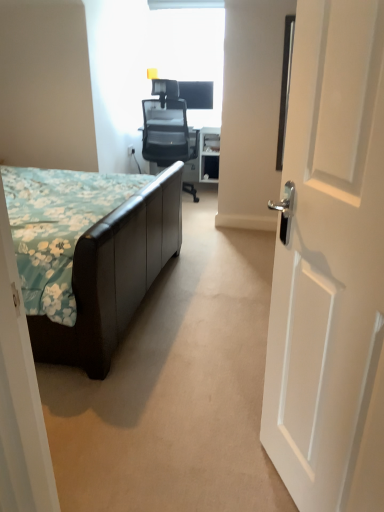
Question: From the image's perspective, does black mesh office chair at center appear lower than brown leather bed at left?

Choices:
 (A) yes
 (B) no

Answer: (B)

Question: Is black mesh office chair at center closer to camera compared to brown leather bed at left?

Choices:
 (A) yes
 (B) no

Answer: (B)

Question: Does black mesh office chair at center appear on the left side of brown leather bed at left?

Choices:
 (A) yes
 (B) no

Answer: (B)

Question: Does black mesh office chair at center have a smaller size compared to brown leather bed at left?

Choices:
 (A) no
 (B) yes

Answer: (B)

Question: Is black mesh office chair at center aimed at brown leather bed at left?

Choices:
 (A) no
 (B) yes

Answer: (A)

Question: From a real-world perspective, is black mesh office chair at center physically below brown leather bed at left?

Choices:
 (A) yes
 (B) no

Answer: (B)

Question: Considering the relative sizes of brown leather bed at left and black mesh office chair at center in the image provided, is brown leather bed at left bigger than black mesh office chair at center?

Choices:
 (A) no
 (B) yes

Answer: (B)

Question: Is brown leather bed at left positioned with its back to black mesh office chair at center?

Choices:
 (A) no
 (B) yes

Answer: (A)

Question: Is brown leather bed at left thinner than black mesh office chair at center?

Choices:
 (A) yes
 (B) no

Answer: (B)

Question: Is brown leather bed at left behind black mesh office chair at center?

Choices:
 (A) no
 (B) yes

Answer: (A)

Question: Does brown leather bed at left have a lesser height compared to black mesh office chair at center?

Choices:
 (A) no
 (B) yes

Answer: (B)

Question: From the image's perspective, is brown leather bed at left located beneath black mesh office chair at center?

Choices:
 (A) yes
 (B) no

Answer: (A)

Question: From a real-world perspective, does white wooden door at right stand above black mesh office chair at center?

Choices:
 (A) yes
 (B) no

Answer: (A)